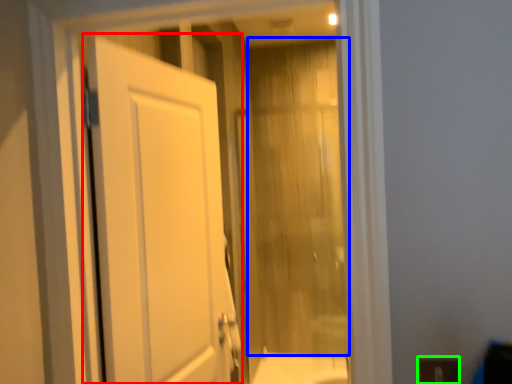
Question: Estimate the real-world distances between objects in this image. Which object is farther from door (highlighted by a red box), curtain (highlighted by a blue box) or electric outlet (highlighted by a green box)?

Choices:
 (A) curtain
 (B) electric outlet

Answer: (A)